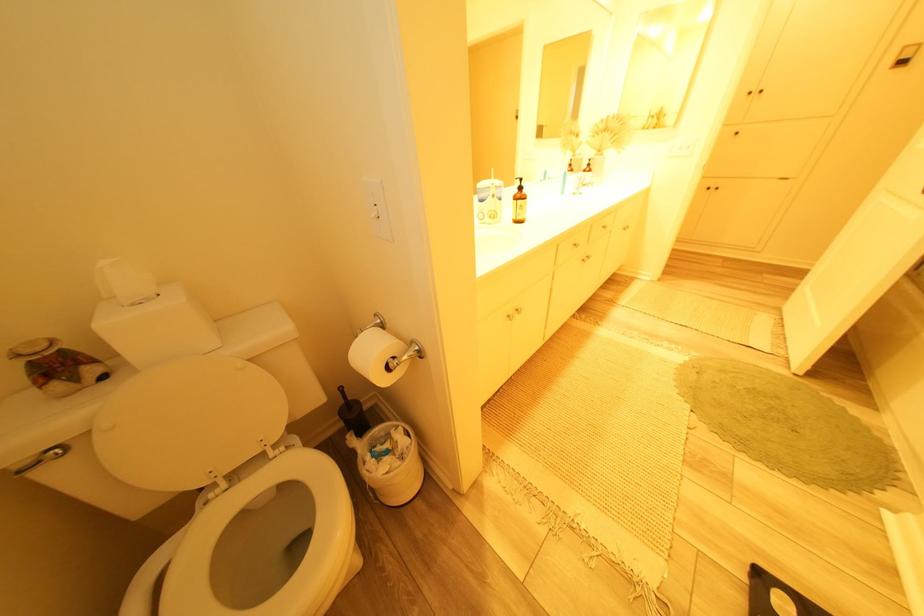
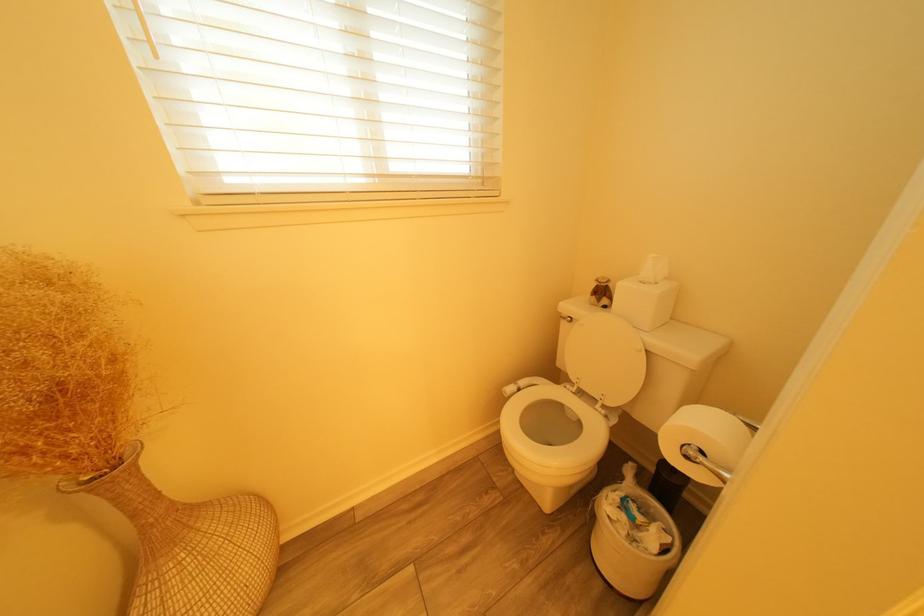
In the second image, find the point that corresponds to point 116,379 in the first image.

(615, 309)